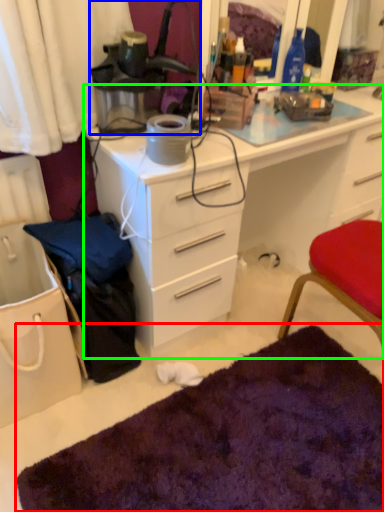
Question: Which is farther away from doormat (highlighted by a red box)? lamp (highlighted by a blue box) or desk (highlighted by a green box)?

Choices:
 (A) lamp
 (B) desk

Answer: (A)